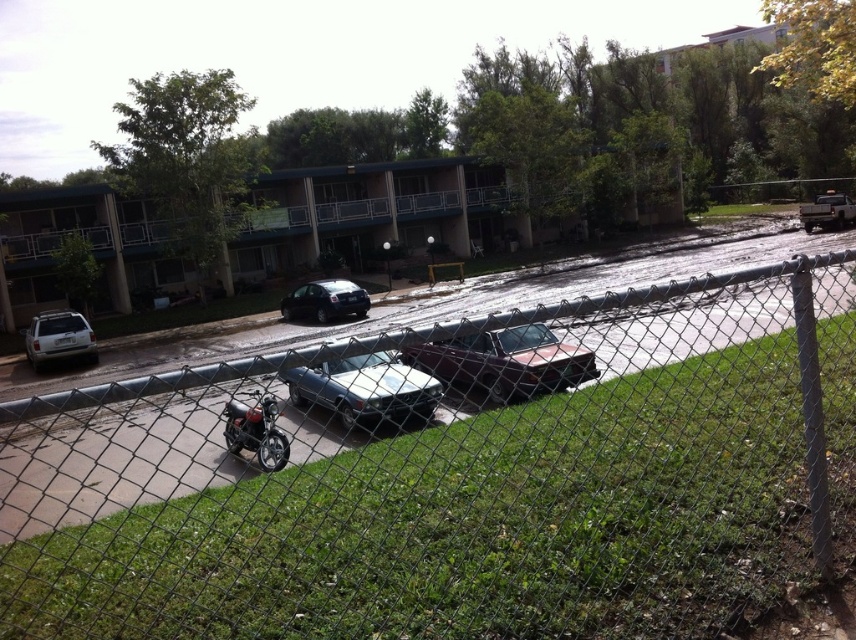
Question: Does metal chain-link fence at center lie behind shiny silver sedan at center?

Choices:
 (A) yes
 (B) no

Answer: (B)

Question: Is shiny chrome motorcycle at lower left thinner than glossy black car at center?

Choices:
 (A) no
 (B) yes

Answer: (A)

Question: Among these objects, which one is farthest from the camera?

Choices:
 (A) shiny silver sedan at center
 (B) maroon metallic sedan at center
 (C) glossy black car at center
 (D) silver metallic suv at left

Answer: (C)

Question: Does maroon metallic sedan at center appear on the left side of shiny chrome motorcycle at lower left?

Choices:
 (A) no
 (B) yes

Answer: (A)

Question: Which object appears farthest from the camera in this image?

Choices:
 (A) maroon metallic sedan at center
 (B) shiny chrome motorcycle at lower left
 (C) silver metallic suv at left

Answer: (C)

Question: Which point is farther to the camera?

Choices:
 (A) (185, 545)
 (B) (424, 385)
 (C) (321, 294)
 (D) (462, 368)

Answer: (C)